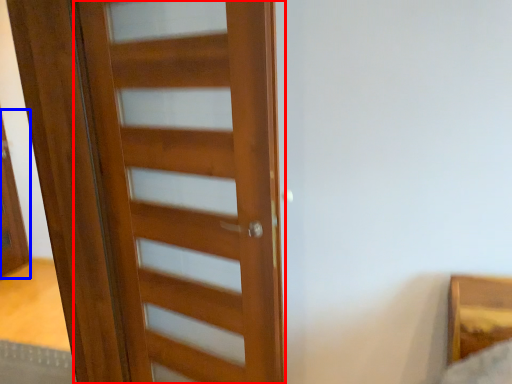
Question: Among these objects, which one is nearest to the camera, door (highlighted by a red box) or screen door (highlighted by a blue box)?

Choices:
 (A) door
 (B) screen door

Answer: (A)